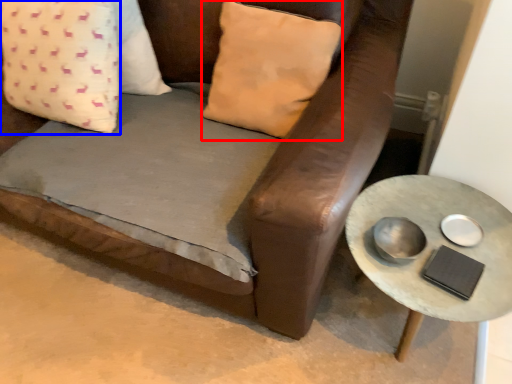
Question: Which point is closer to the camera, pillow (highlighted by a red box) or pillow (highlighted by a blue box)?

Choices:
 (A) pillow
 (B) pillow

Answer: (A)